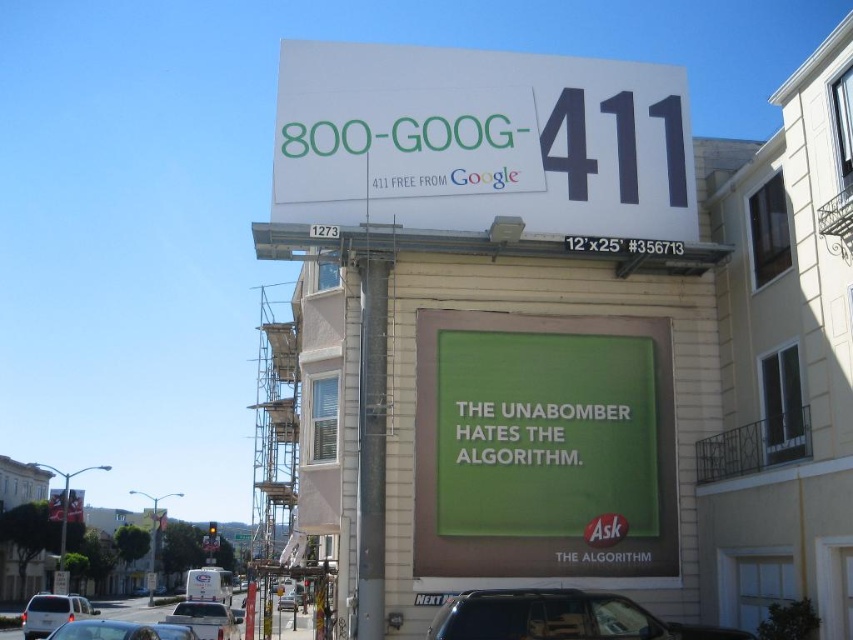
Does white paper billboard at upper center appear on the right side of metallic silver car at lower left?

Yes, white paper billboard at upper center is to the right of metallic silver car at lower left.

Which is above, white paper billboard at upper center or metallic silver car at lower left?

white paper billboard at upper center is higher up.

Between point (671, 198) and point (119, 625), which one is positioned in front?

Point (119, 625) is in front.

This screenshot has width=853, height=640. Identify the location of white paper billboard at upper center. (480, 141).

Who is positioned more to the left, green matte sign at center or silver metallic van at lower left?

silver metallic van at lower left

Is point (440, 326) behind point (50, 605)?

No, (440, 326) is closer to viewer.

Which is behind, point (434, 481) or point (67, 604)?

Positioned behind is point (67, 604).

Where is `green matte sign at center`? Image resolution: width=853 pixels, height=640 pixels. green matte sign at center is located at coordinates (543, 445).

Is white paper billboard at upper center further to camera compared to silver metallic van at lower left?

No.

Is white paper billboard at upper center thinner than silver metallic van at lower left?

Correct, white paper billboard at upper center's width is less than silver metallic van at lower left's.

Which is behind, point (397, 195) or point (44, 604)?

Positioned behind is point (44, 604).

This screenshot has height=640, width=853. I want to click on white paper billboard at upper center, so click(x=480, y=141).